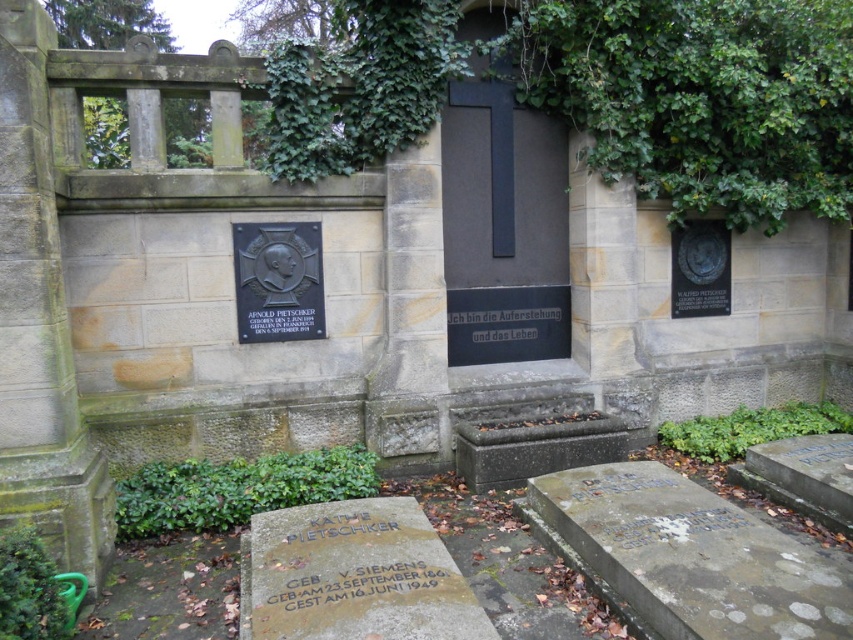
Is white stone inscription at lower right above black metal plaque at center left?

Incorrect, white stone inscription at lower right is not positioned above black metal plaque at center left.

Which is above, white stone inscription at lower right or black metal plaque at center left?

Positioned higher is black metal plaque at center left.

Identify the location of white stone inscription at lower right. Image resolution: width=853 pixels, height=640 pixels. (674, 525).

Find the location of `white stone inscription at lower right`. white stone inscription at lower right is located at coordinates (674, 525).

Does polished bronze plaque at center left have a greater width compared to black metal plaque at center left?

Correct, the width of polished bronze plaque at center left exceeds that of black metal plaque at center left.

Which is more to the right, polished bronze plaque at center left or black metal plaque at center left?

From the viewer's perspective, black metal plaque at center left appears more on the right side.

Does point (289, 250) come behind point (317, 320)?

No, it is not.

Locate an element on the screen. polished bronze plaque at center left is located at coordinates (x=277, y=282).

Which of these two, polished bronze plaque at center left or gold engraved stone at lower center, stands shorter?

gold engraved stone at lower center

Between point (311, 272) and point (624, 486), which one is positioned behind?

The point (311, 272) is more distant.

Is point (254, 273) closer to camera compared to point (627, 474)?

No, (254, 273) is further to viewer.

At what (x,y) coordinates should I click in order to perform the action: click on polished bronze plaque at center left. Please return your answer as a coordinate pair (x, y). This screenshot has width=853, height=640. Looking at the image, I should click on (277, 282).